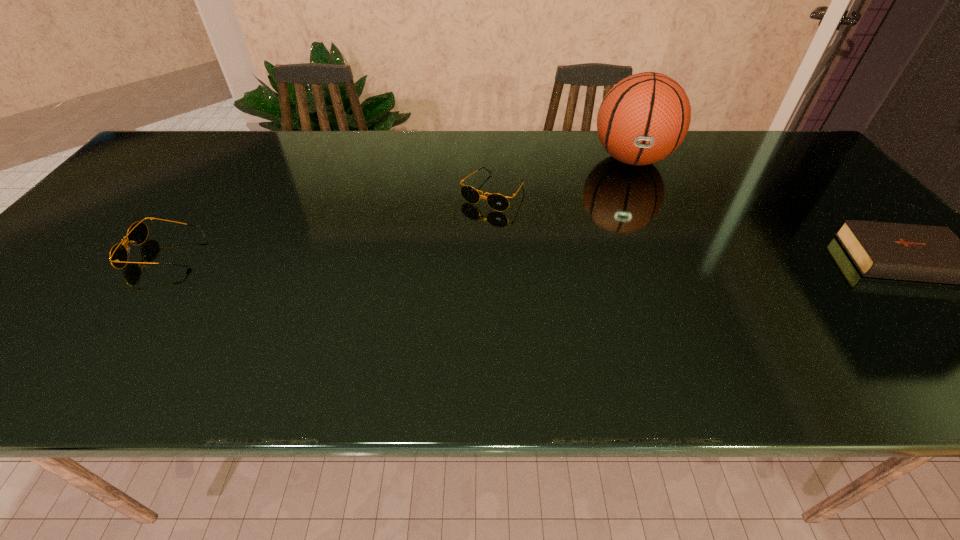
Where is `object identified as the third closest to the farther sunglasses`? object identified as the third closest to the farther sunglasses is located at coordinates (924, 253).

Locate an element on the screen. object that ranks as the third closest to the third object from right to left is located at coordinates (924, 253).